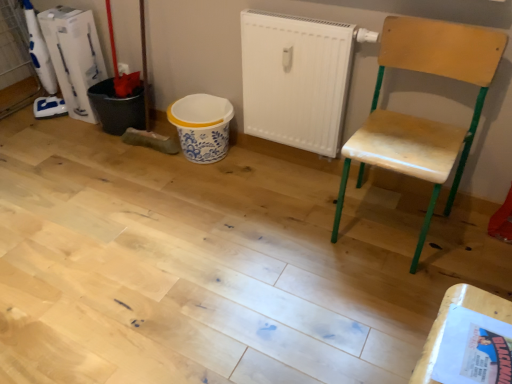
Question: From the image's perspective, is white matte radiator at center beneath wooden chair at right?

Choices:
 (A) no
 (B) yes

Answer: (A)

Question: Is white matte radiator at center facing towards wooden chair at right?

Choices:
 (A) yes
 (B) no

Answer: (B)

Question: Is white matte radiator at center behind wooden chair at right?

Choices:
 (A) yes
 (B) no

Answer: (A)

Question: Can you confirm if white matte radiator at center is positioned to the right of wooden chair at right?

Choices:
 (A) no
 (B) yes

Answer: (A)

Question: Is white matte radiator at center positioned far away from wooden chair at right?

Choices:
 (A) no
 (B) yes

Answer: (A)

Question: Is white matte radiator at center wider than wooden chair at right?

Choices:
 (A) yes
 (B) no

Answer: (B)

Question: Does wooden chair at right have a smaller size compared to white plastic bucket at left?

Choices:
 (A) no
 (B) yes

Answer: (A)

Question: From a real-world perspective, does wooden chair at right sit lower than white plastic bucket at left?

Choices:
 (A) yes
 (B) no

Answer: (B)

Question: From the image's perspective, is wooden chair at right located beneath white plastic bucket at left?

Choices:
 (A) yes
 (B) no

Answer: (A)

Question: Does wooden chair at right have a greater width compared to white plastic bucket at left?

Choices:
 (A) no
 (B) yes

Answer: (B)

Question: Would you say wooden chair at right is outside white plastic bucket at left?

Choices:
 (A) yes
 (B) no

Answer: (A)

Question: Is wooden chair at right in contact with white plastic bucket at left?

Choices:
 (A) no
 (B) yes

Answer: (A)

Question: Considering the relative sizes of white plastic bucket at left and wooden chair at right in the image provided, is white plastic bucket at left wider than wooden chair at right?

Choices:
 (A) yes
 (B) no

Answer: (B)